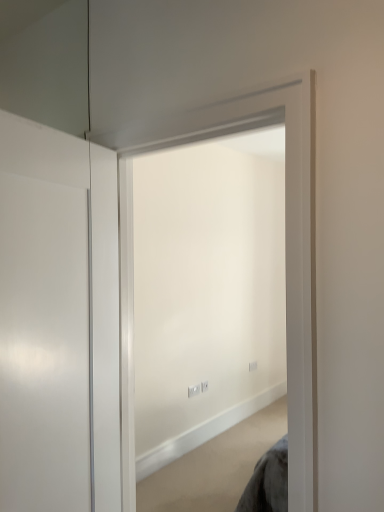
Question: Is white glossy door at left to the left or to the right of white matte wall at center in the image?

Choices:
 (A) left
 (B) right

Answer: (A)

Question: From a real-world perspective, relative to white matte wall at center, is white glossy door at left vertically above or below?

Choices:
 (A) above
 (B) below

Answer: (A)

Question: Considering their positions, is white glossy door at left located in front of or behind white matte wall at center?

Choices:
 (A) behind
 (B) front

Answer: (B)

Question: From the image's perspective, is white matte wall at center above or below white glossy door at left?

Choices:
 (A) below
 (B) above

Answer: (B)

Question: Is white matte wall at center in front of or behind white glossy door at left in the image?

Choices:
 (A) front
 (B) behind

Answer: (B)

Question: Is white matte wall at center to the left or to the right of white glossy door at left in the image?

Choices:
 (A) right
 (B) left

Answer: (A)

Question: From a real-world perspective, is white matte wall at center positioned above or below white glossy door at left?

Choices:
 (A) above
 (B) below

Answer: (B)